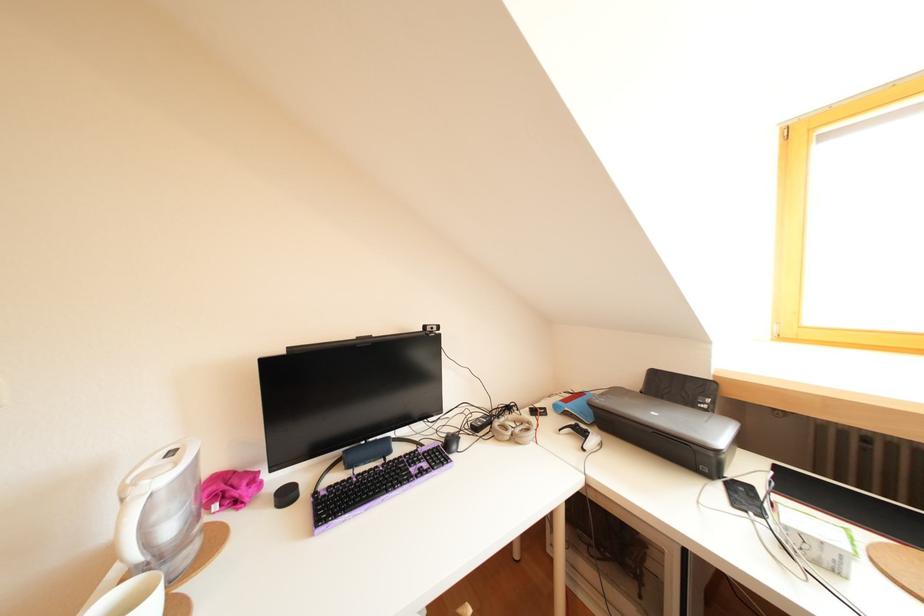
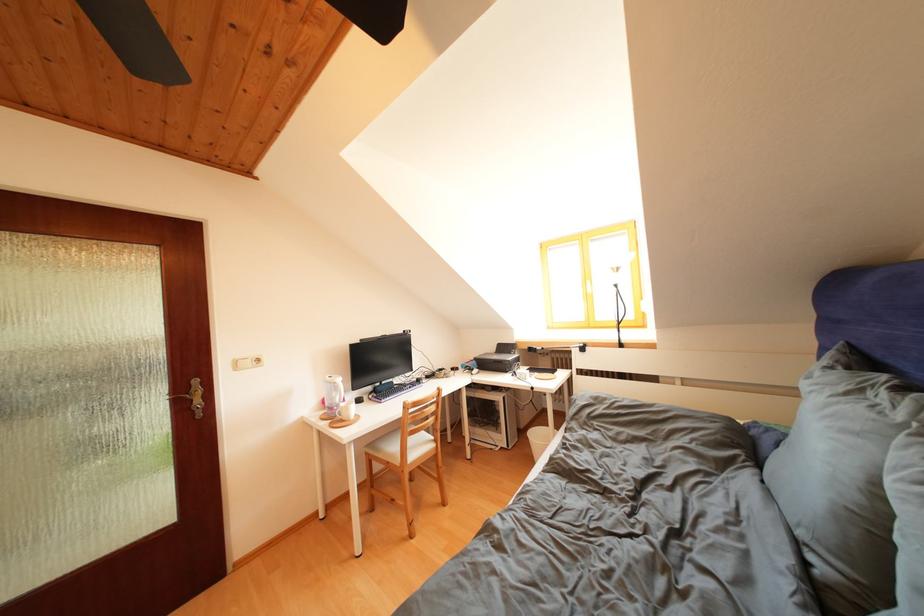
Question: In a continuous first-person perspective shot, in which direction is the camera moving?

Choices:
 (A) Left
 (B) Right
 (C) Forward
 (D) Backward

Answer: (D)